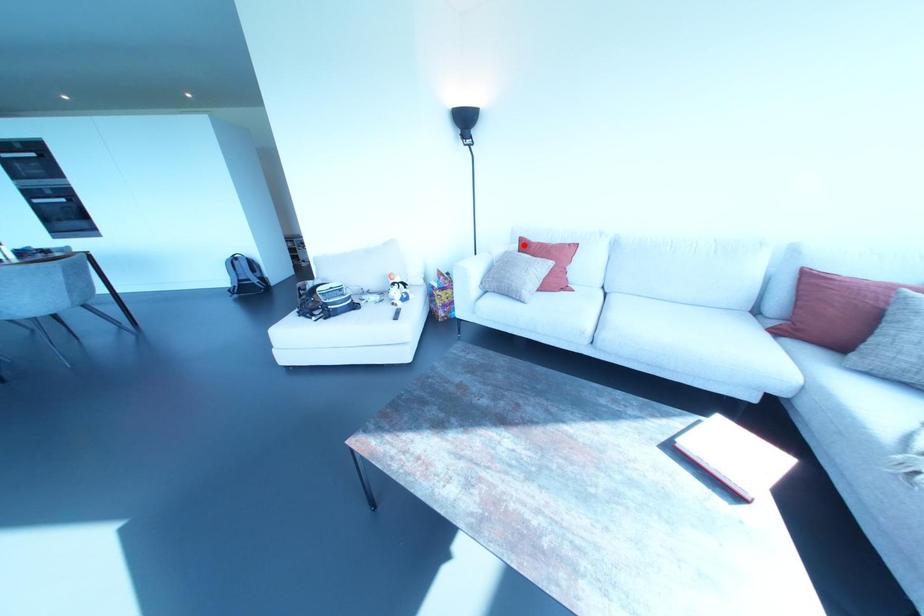
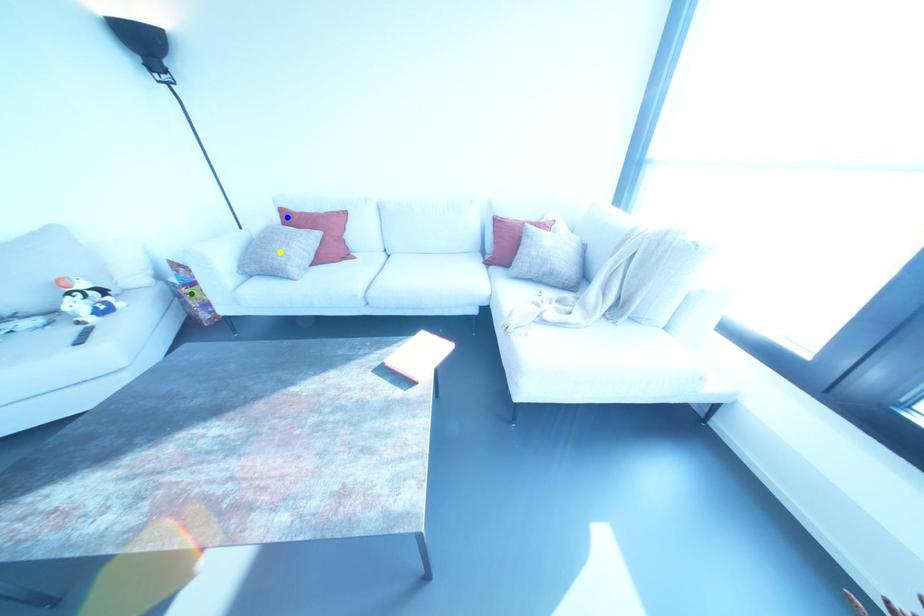
Question: I am providing you with two images of the same scene from different viewpoints. A red point is marked on the first image. You are given multiple points on the second image. Which point in image 2 is actually the same real-world point as the red point in image 1?

Choices:
 (A) yellow point
 (B) green point
 (C) blue point

Answer: (C)